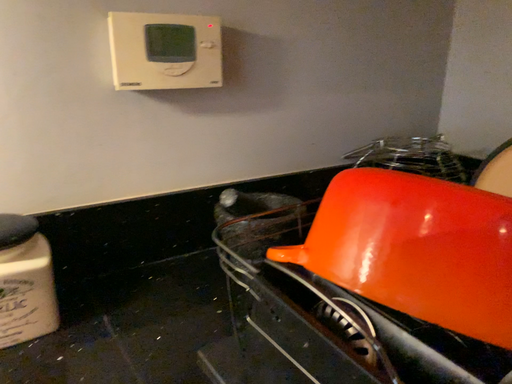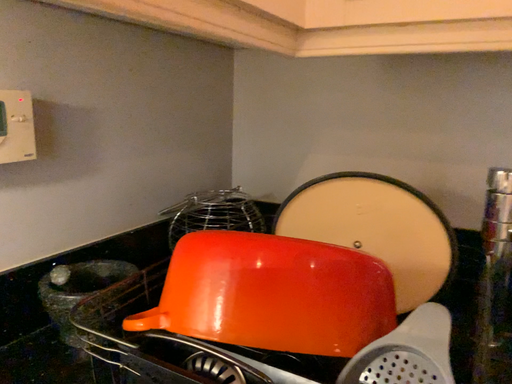
Question: Which way did the camera rotate in the video?

Choices:
 (A) rotated downward
 (B) rotated upward

Answer: (B)